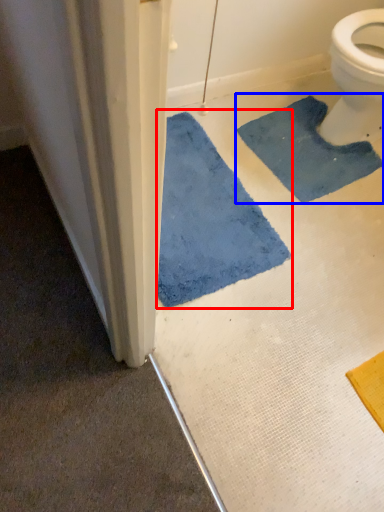
Question: Among these objects, which one is farthest to the camera, bath mat (highlighted by a red box) or bath mat (highlighted by a blue box)?

Choices:
 (A) bath mat
 (B) bath mat

Answer: (B)